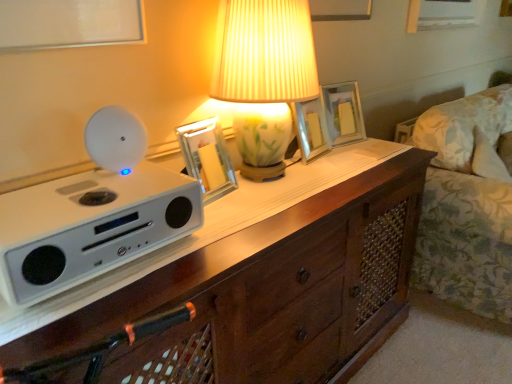
Question: From the image's perspective, is white matte speaker at left above or below metallic silver picture frame at center, the 3th picture frame in the back-to-front sequence?

Choices:
 (A) above
 (B) below

Answer: (B)

Question: From a real-world perspective, relative to metallic silver picture frame at center, the third picture frame from the right, is white matte speaker at left vertically above or below?

Choices:
 (A) above
 (B) below

Answer: (B)

Question: Which is farther from the metallic silver picture frame at center, positioned as the 1th picture frame in front-to-back order?

Choices:
 (A) white matte speaker at left
 (B) matte glass picture frame at center, which appears as the 3th picture frame when viewed from the front
 (C) floral fabric couch at right
 (D) wooden chest of drawers at center
 (E) porcelain floral lamp at center

Answer: (C)

Question: Which of these objects is positioned farthest from the floral fabric couch at right?

Choices:
 (A) porcelain floral lamp at center
 (B) matte glass picture frame at center, the 1th picture frame from the right
 (C) metallic silver picture frame at center, the third picture frame from the right
 (D) wooden chest of drawers at center
 (E) white matte speaker at left

Answer: (E)